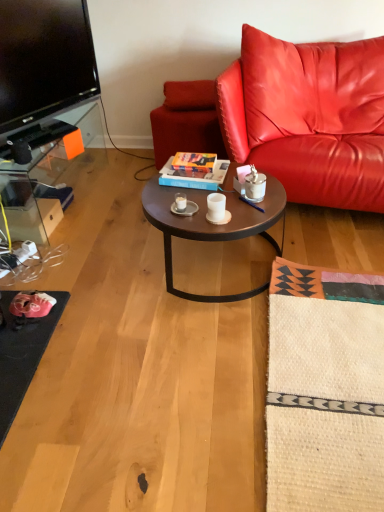
Find the location of a particular element. The width and height of the screenshot is (384, 512). free space between white matte cup at center, which ranks as the 2th coffee cup in left-to-right order, and white ceramic mug at center, which appears as the 2th coffee cup when viewed from the right is located at coordinates (199, 209).